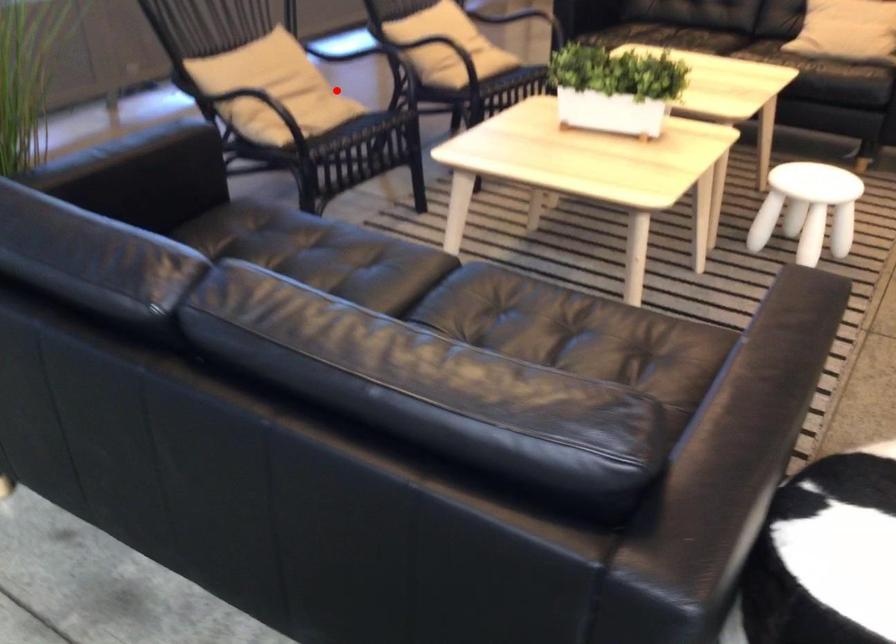
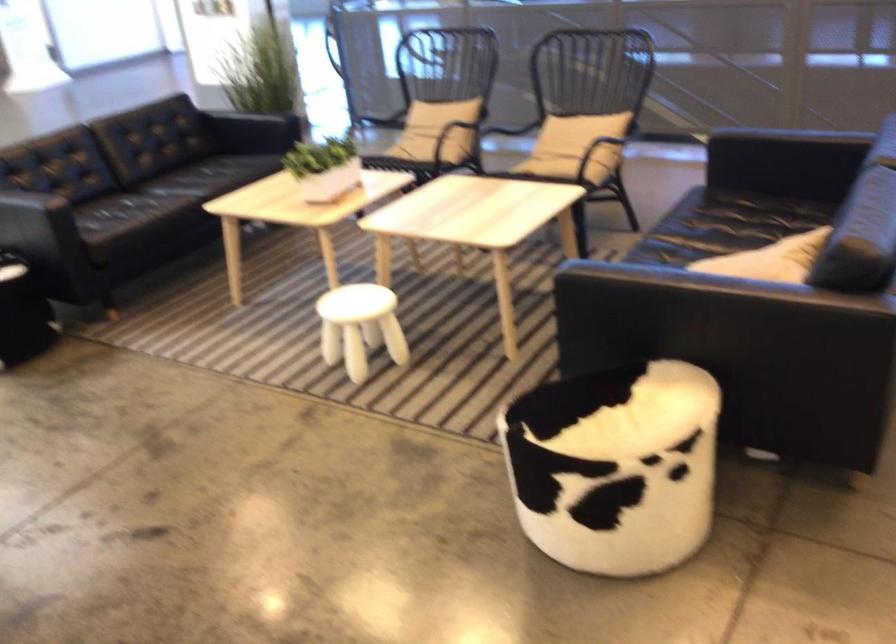
Question: I am providing you with two images of the same scene from different viewpoints. Image1 has a red point marked. In image2, the corresponding 3D location appears at what relative position? Reply with the corresponding letter.

Choices:
 (A) Closer
 (B) Farther

Answer: (B)